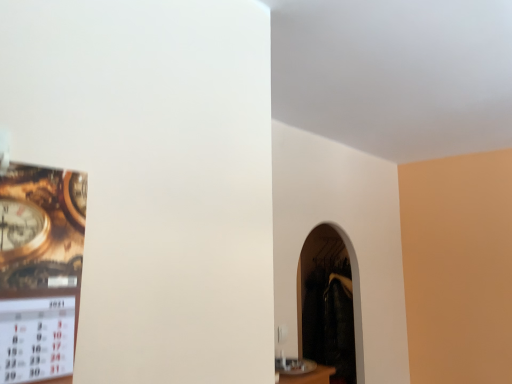
Image resolution: width=512 pixels, height=384 pixels. Describe the element at coordinates (329, 302) in the screenshot. I see `dark matte fireplace at center` at that location.

I want to click on dark matte fireplace at center, so click(x=329, y=302).

Find the location of `dark matte fireplace at center`. dark matte fireplace at center is located at coordinates (329, 302).